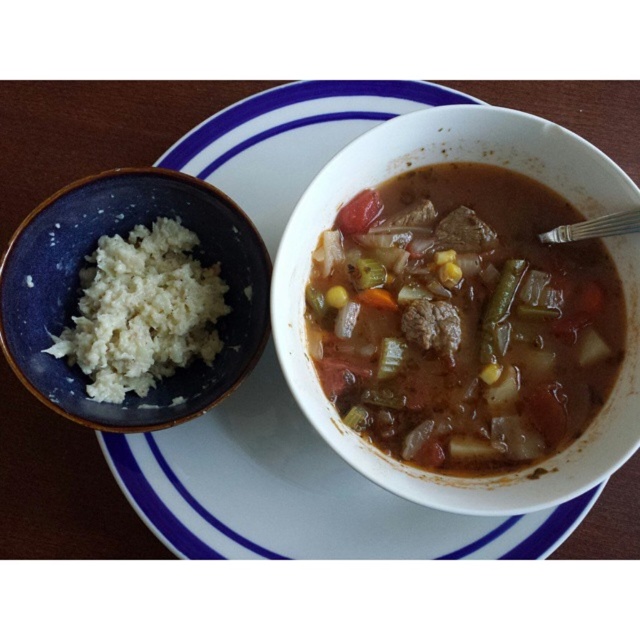
Question: Is brown meat at center positioned before green translucent celery at center?

Choices:
 (A) yes
 (B) no

Answer: (A)

Question: Which object is closer to the camera taking this photo?

Choices:
 (A) brown matte/starchy soup at center
 (B) green translucent celery at center

Answer: (A)

Question: Which object is positioned closest to the white glossy plate at center?

Choices:
 (A) green translucent celery at center
 (B) green leafy vegetable at center
 (C) brown matte/starchy soup at center

Answer: (C)

Question: Among these objects, which one is nearest to the camera?

Choices:
 (A) white glossy plate at center
 (B) green leafy vegetable at center
 (C) orange smooth carrot at center

Answer: (A)

Question: Where is green leafy vegetable at upper center located in relation to yellow-green textured celery at center in the image?

Choices:
 (A) below
 (B) above

Answer: (B)

Question: Does white glossy plate at center appear over yellow-green textured celery at center?

Choices:
 (A) no
 (B) yes

Answer: (A)